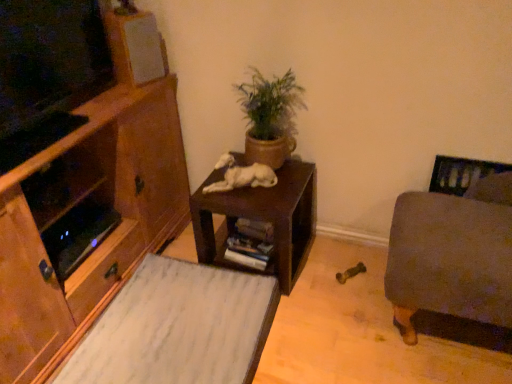
Question: Considering the relative sizes of green matte plant pot at center and white matte speaker at upper left in the image provided, is green matte plant pot at center wider than white matte speaker at upper left?

Choices:
 (A) no
 (B) yes

Answer: (B)

Question: Is green matte plant pot at center touching white matte speaker at upper left?

Choices:
 (A) no
 (B) yes

Answer: (A)

Question: Is green matte plant pot at center positioned with its back to white matte speaker at upper left?

Choices:
 (A) no
 (B) yes

Answer: (A)

Question: Is green matte plant pot at center located outside white matte speaker at upper left?

Choices:
 (A) no
 (B) yes

Answer: (B)

Question: Can you confirm if green matte plant pot at center is shorter than white matte speaker at upper left?

Choices:
 (A) yes
 (B) no

Answer: (B)

Question: Would you say white matte speaker at upper left is part of green matte plant pot at center's contents?

Choices:
 (A) no
 (B) yes

Answer: (A)

Question: Is white fur dog at center positioned far away from velvet gray ottoman at right?

Choices:
 (A) no
 (B) yes

Answer: (A)

Question: Could velvet gray ottoman at right be considered to be inside white fur dog at center?

Choices:
 (A) no
 (B) yes

Answer: (A)

Question: Considering the relative sizes of white fur dog at center and velvet gray ottoman at right in the image provided, is white fur dog at center bigger than velvet gray ottoman at right?

Choices:
 (A) yes
 (B) no

Answer: (B)

Question: Is white fur dog at center facing away from velvet gray ottoman at right?

Choices:
 (A) yes
 (B) no

Answer: (B)

Question: From the image's perspective, is white fur dog at center under velvet gray ottoman at right?

Choices:
 (A) no
 (B) yes

Answer: (A)

Question: Could you tell me if white fur dog at center is facing velvet gray ottoman at right?

Choices:
 (A) yes
 (B) no

Answer: (B)

Question: Is velvet gray ottoman at right shorter than green matte plant pot at center?

Choices:
 (A) no
 (B) yes

Answer: (A)